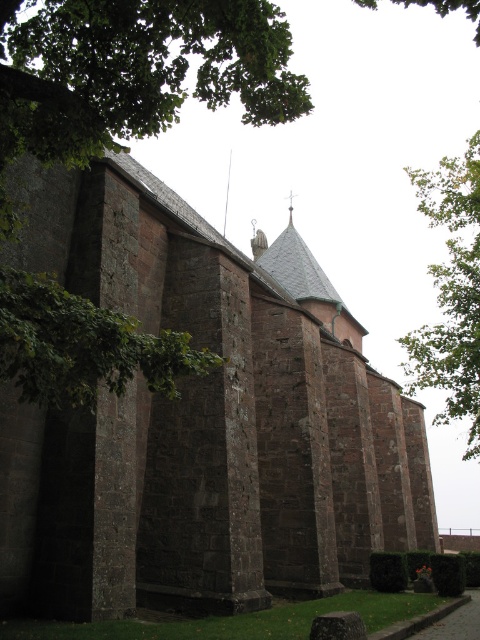
Question: Can you confirm if green leafy tree at upper left is bigger than green leafy tree at upper right?

Choices:
 (A) no
 (B) yes

Answer: (A)

Question: Estimate the real-world distances between objects in this image. Which object is farther from the brown stone church at center?

Choices:
 (A) green leafy tree at upper right
 (B) green leafy tree at upper left

Answer: (A)

Question: Which object is positioned closest to the green leafy tree at upper right?

Choices:
 (A) brown stone church at center
 (B) green leafy tree at upper left

Answer: (A)

Question: Is green leafy tree at upper left bigger than green leafy tree at upper right?

Choices:
 (A) yes
 (B) no

Answer: (B)

Question: Is green leafy tree at upper left above green leafy tree at upper right?

Choices:
 (A) yes
 (B) no

Answer: (A)

Question: Which point is farther to the camera?

Choices:
 (A) green leafy tree at upper left
 (B) green leafy tree at upper right
 (C) brown stone church at center

Answer: (B)